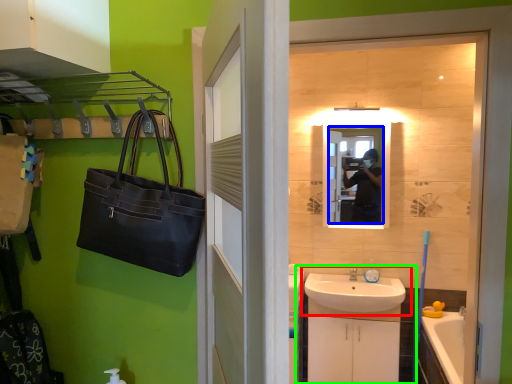
Question: Which is nearer to the sink (highlighted by a red box)? mirror (highlighted by a blue box) or bathroom cabinet (highlighted by a green box).

Choices:
 (A) mirror
 (B) bathroom cabinet

Answer: (B)